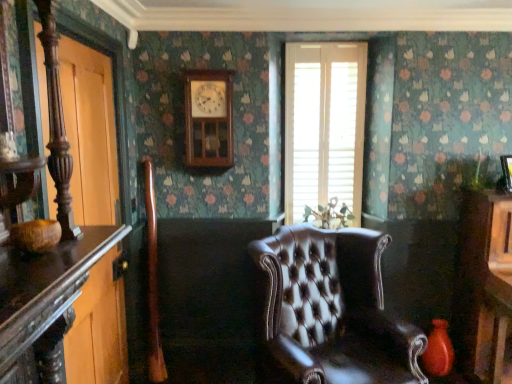
This screenshot has width=512, height=384. In order to click on green glossy plant at center in this screenshot , I will do click(x=329, y=215).

This screenshot has width=512, height=384. Describe the element at coordinates (208, 118) in the screenshot. I see `wooden clock at upper center` at that location.

The image size is (512, 384). What do you see at coordinates (324, 125) in the screenshot?
I see `white wood blinds at center` at bounding box center [324, 125].

The image size is (512, 384). What do you see at coordinates (438, 350) in the screenshot?
I see `matte red vase at lower right` at bounding box center [438, 350].

Find the location of `brown leather chair at center`. brown leather chair at center is located at coordinates (333, 308).

This screenshot has height=384, width=512. I want to click on plant behind the wooden clock at upper center, so click(x=329, y=215).

From their relative heights in the image, would you say green glossy plant at center is taller or shorter than wooden clock at upper center?

Considering their sizes, green glossy plant at center has less height than wooden clock at upper center.

Between green glossy plant at center and wooden clock at upper center, which one has smaller width?

Thinner between the two is wooden clock at upper center.

From the image's perspective, is matte red vase at lower right located above or below white wood blinds at center?

matte red vase at lower right is below white wood blinds at center.

Is matte red vase at lower right not within white wood blinds at center?

Indeed, matte red vase at lower right is completely outside white wood blinds at center.

Based on the photo, from a real-world perspective, relative to white wood blinds at center, is matte red vase at lower right vertically above or below?

Clearly, from a real-world perspective, matte red vase at lower right is below white wood blinds at center.

In terms of height, does matte red vase at lower right look taller or shorter compared to white wood blinds at center?

matte red vase at lower right is shorter than white wood blinds at center.

Can you confirm if green glossy plant at center is smaller than brown leather chair at center?

Correct, green glossy plant at center occupies less space than brown leather chair at center.

Is green glossy plant at center next to brown leather chair at center and touching it?

No.

Is green glossy plant at center turned away from brown leather chair at center?

No, green glossy plant at center is not facing away from brown leather chair at center.

Is the depth of green glossy plant at center greater than that of brown leather chair at center?

Yes, it is.

Which object is thinner, matte red vase at lower right or wooden clock at upper center?

wooden clock at upper center is thinner.

Which object is positioned more to the right, matte red vase at lower right or wooden clock at upper center?

matte red vase at lower right.

Which is less distant, (x=431, y=336) or (x=213, y=155)?

Point (x=431, y=336).

Can you see matte red vase at lower right touching wooden clock at upper center?

matte red vase at lower right and wooden clock at upper center are not in contact.

Looking at this image, is matte red vase at lower right bigger than green glossy plant at center?

Incorrect, matte red vase at lower right is not larger than green glossy plant at center.

How many degrees apart are the facing directions of matte red vase at lower right and green glossy plant at center?

The angular difference between matte red vase at lower right and green glossy plant at center is 1.45 degrees.

Consider the image. Is matte red vase at lower right situated inside green glossy plant at center or outside?

matte red vase at lower right lies outside green glossy plant at center.

Where is `plant behind the matte red vase at lower right`? Image resolution: width=512 pixels, height=384 pixels. plant behind the matte red vase at lower right is located at coordinates (329, 215).

Find the location of a particular element. This screenshot has height=384, width=512. clock located on the left of white wood blinds at center is located at coordinates (208, 118).

Does wooden clock at upper center have a lesser width compared to white wood blinds at center?

In fact, wooden clock at upper center might be wider than white wood blinds at center.

Could you tell me if wooden clock at upper center is facing white wood blinds at center?

No, wooden clock at upper center is not oriented towards white wood blinds at center.

Considering the sizes of objects wooden clock at upper center and white wood blinds at center in the image provided, who is bigger, wooden clock at upper center or white wood blinds at center?

white wood blinds at center is bigger.

Does matte red vase at lower right turn towards brown leather chair at center?

No, matte red vase at lower right is not turned towards brown leather chair at center.

Can you confirm if matte red vase at lower right is wider than brown leather chair at center?

Incorrect, the width of matte red vase at lower right does not surpass that of brown leather chair at center.

Are matte red vase at lower right and brown leather chair at center beside each other?

No, matte red vase at lower right is not next to brown leather chair at center.

From a real-world perspective, is matte red vase at lower right below brown leather chair at center?

Correct, in the physical world, matte red vase at lower right is lower than brown leather chair at center.

The height and width of the screenshot is (384, 512). Identify the location of plant that appears below the wooden clock at upper center (from the image's perspective). (329, 215).

Where is `window above the matte red vase at lower right (from the image's perspective)`? This screenshot has width=512, height=384. window above the matte red vase at lower right (from the image's perspective) is located at coordinates (324, 125).

Based on their spatial positions, is green glossy plant at center or matte red vase at lower right closer to white wood blinds at center?

green glossy plant at center lies closer to white wood blinds at center than the other object.

When comparing their distances from brown leather chair at center, does white wood blinds at center or matte red vase at lower right seem further?

Among the two, white wood blinds at center is located further to brown leather chair at center.

Which object lies nearer to the anchor point brown leather chair at center, matte red vase at lower right or wooden clock at upper center?

The object closer to brown leather chair at center is matte red vase at lower right.

Estimate the real-world distances between objects in this image. Which object is further from white wood blinds at center, wooden clock at upper center or matte red vase at lower right?

matte red vase at lower right lies further to white wood blinds at center than the other object.

From the image, which object appears to be farther from brown leather chair at center, matte red vase at lower right or white wood blinds at center?

white wood blinds at center.

Estimate the real-world distances between objects in this image. Which object is further from brown leather chair at center, matte red vase at lower right or green glossy plant at center?

green glossy plant at center is further to brown leather chair at center.

Looking at the image, which one is located further to green glossy plant at center, matte red vase at lower right or wooden clock at upper center?

Among the two, matte red vase at lower right is located further to green glossy plant at center.

Which object lies further to the anchor point brown leather chair at center, green glossy plant at center or matte red vase at lower right?

The object further to brown leather chair at center is green glossy plant at center.

Locate an element on the screen. Image resolution: width=512 pixels, height=384 pixels. plant between wooden clock at upper center and matte red vase at lower right is located at coordinates (329, 215).

Where is `plant between white wood blinds at center and matte red vase at lower right in the vertical direction`? Image resolution: width=512 pixels, height=384 pixels. plant between white wood blinds at center and matte red vase at lower right in the vertical direction is located at coordinates (329, 215).

Find the location of a particular element. The width and height of the screenshot is (512, 384). window that lies between wooden clock at upper center and brown leather chair at center from top to bottom is located at coordinates (324, 125).

The image size is (512, 384). I want to click on chair between wooden clock at upper center and matte red vase at lower right vertically, so click(333, 308).